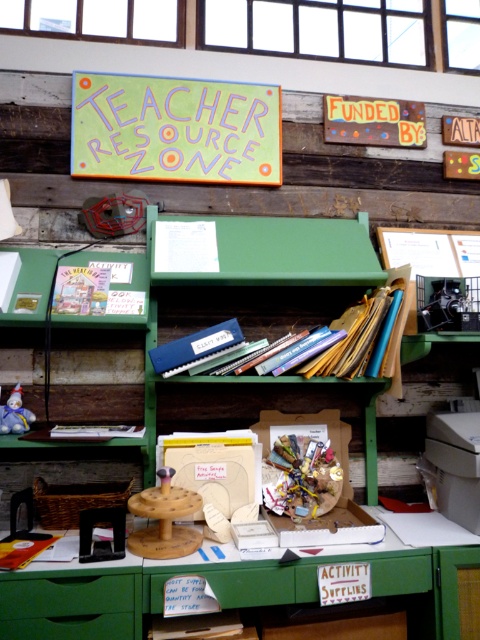
Does blue cardboard book at center appear under matte white book at center?

No.

Does point (384, 310) come in front of point (110, 424)?

Yes, point (384, 310) is closer to viewer.

Is point (368, 301) positioned in front of point (66, 428)?

That is False.

Locate an element on the screen. Image resolution: width=480 pixels, height=640 pixels. blue cardboard book at center is located at coordinates (348, 340).

Which is in front, point (191, 356) or point (87, 435)?

Point (87, 435) is in front.

The height and width of the screenshot is (640, 480). I want to click on blue matte folder at center, so click(x=195, y=348).

Where is `green wood table at lower center`? Image resolution: width=480 pixels, height=640 pixels. green wood table at lower center is located at coordinates (225, 588).

Who is more distant from viewer, (x=92, y=628) or (x=10, y=426)?

Positioned behind is point (x=10, y=426).

You are a GUI agent. You are given a task and a screenshot of the screen. Output one action in this format:
    pyautogui.click(x=<x>, y=<y>)
    Task: Click on the green wood table at lower center
    This screenshot has height=640, width=480.
    Given the screenshot: What is the action you would take?
    pyautogui.click(x=225, y=588)